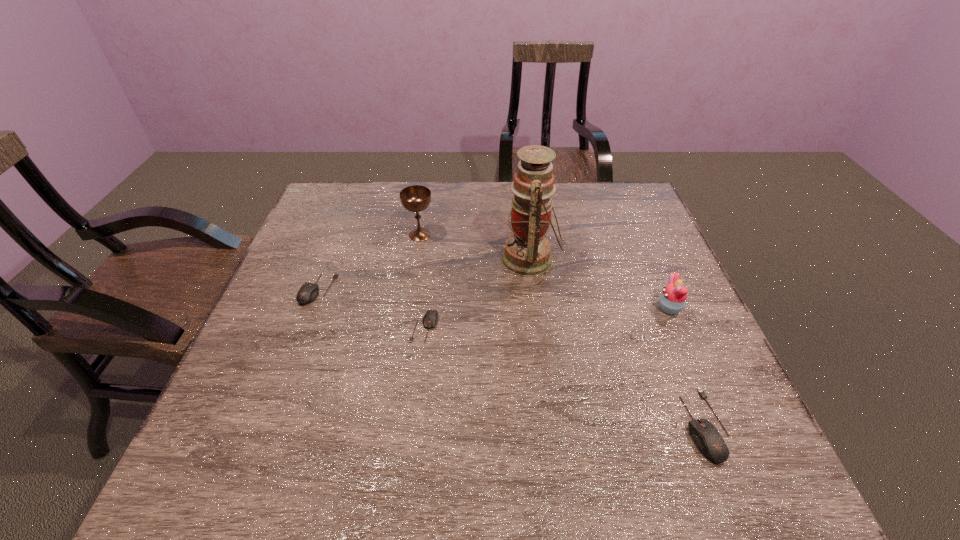
I want to click on free space located on the right of the leftmost mouse, so click(x=436, y=289).

Identify the location of vacant space located on the right of the second mouse from right to left. (x=558, y=327).

I want to click on free space located on the left of the nearest object, so click(x=623, y=425).

Locate an element on the screen. This screenshot has width=960, height=540. vacant position located on the left of the chalice is located at coordinates (385, 235).

Where is `free spot located on the left of the oil lamp`? The height and width of the screenshot is (540, 960). free spot located on the left of the oil lamp is located at coordinates (446, 259).

Identify the location of free space located 0.170m on the face of the third tallest object. (587, 308).

Where is `vacant space located 0.370m on the face of the third tallest object`? vacant space located 0.370m on the face of the third tallest object is located at coordinates (505, 308).

Where is `free space located 0.160m on the face of the third tallest object`? free space located 0.160m on the face of the third tallest object is located at coordinates (591, 308).

In order to click on object that is at the near edge in this screenshot , I will do `click(707, 438)`.

Locate an element on the screen. The width and height of the screenshot is (960, 540). object present at the left edge is located at coordinates (308, 292).